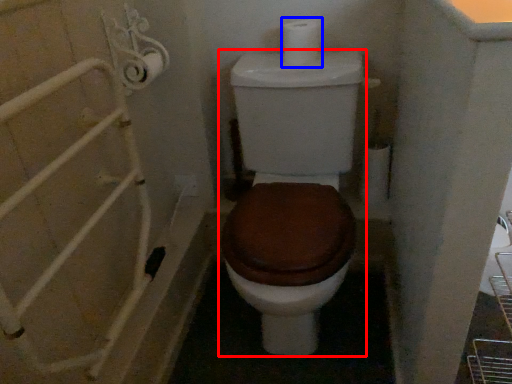
Question: Which object appears farthest to the camera in this image, toilet (highlighted by a red box) or toilet paper (highlighted by a blue box)?

Choices:
 (A) toilet
 (B) toilet paper

Answer: (B)